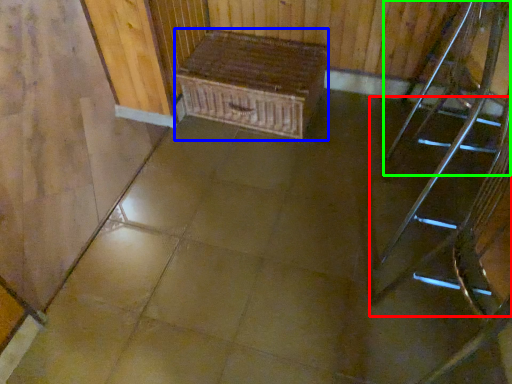
Question: Which object is positioned farthest from stairs (highlighted by a red box)? Select from furniture (highlighted by a blue box) and chair (highlighted by a green box).

Choices:
 (A) furniture
 (B) chair

Answer: (A)